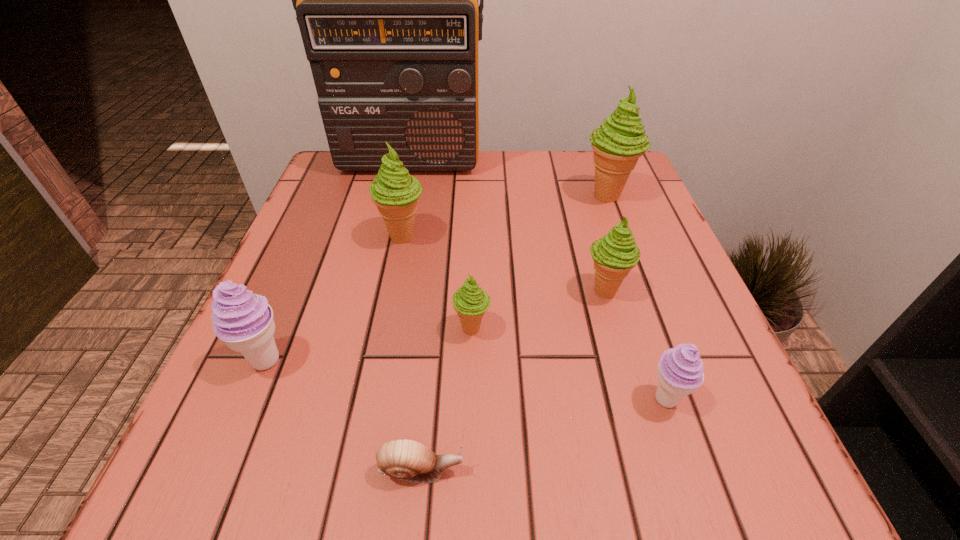
This screenshot has width=960, height=540. I want to click on the tallest object, so click(386, 0).

Find the location of a particular element. radio receiver is located at coordinates (386, 0).

At what (x,y) coordinates should I click in order to perform the action: click on the seventh shortest object. Please return your answer as a coordinate pair (x, y). The image size is (960, 540). Looking at the image, I should click on (618, 143).

Locate an element on the screen. This screenshot has height=540, width=960. the farthest green icecream is located at coordinates (618, 143).

This screenshot has width=960, height=540. What are the coordinates of `the second farthest green icecream` in the screenshot? It's located at (394, 191).

Locate an element on the screen. the leftmost green icecream is located at coordinates (394, 191).

Identify the location of the third farthest green icecream. (614, 255).

In order to click on the third biggest green icecream in this screenshot , I will do `click(614, 255)`.

Locate an element on the screen. Image resolution: width=960 pixels, height=540 pixels. the leftmost icecream is located at coordinates (244, 321).

This screenshot has height=540, width=960. What are the coordinates of `the left purple icecream` in the screenshot? It's located at coord(244,321).